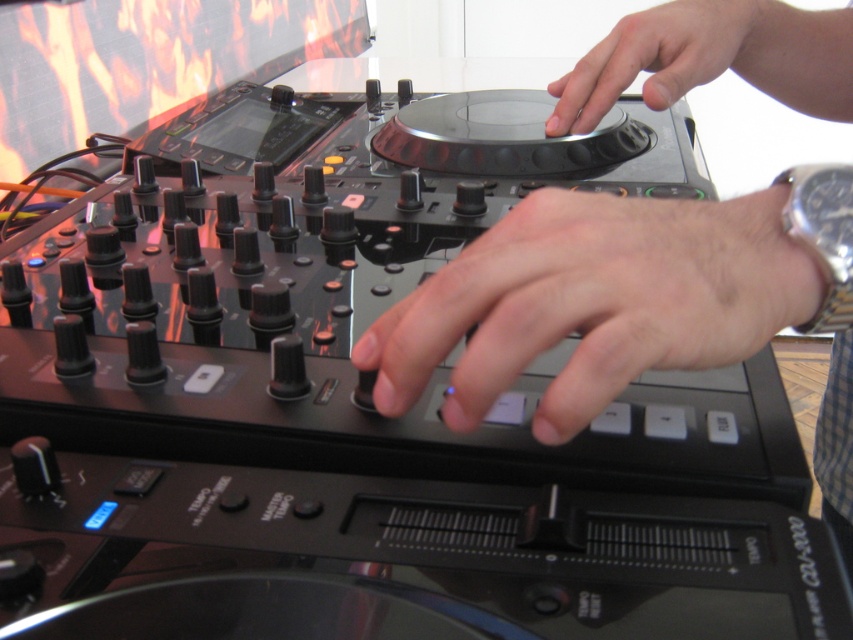
Question: Considering the relative positions of metallic silver turntable at center and matte black turntable at center in the image provided, where is metallic silver turntable at center located with respect to matte black turntable at center?

Choices:
 (A) below
 (B) above

Answer: (A)

Question: Estimate the real-world distances between objects in this image. Which object is closer to the smooth skin hand at center?

Choices:
 (A) metallic silver turntable at center
 (B) silver metallic watch at upper right
 (C) matte black turntable at center

Answer: (B)

Question: Is metallic silver turntable at center positioned in front of smooth skin hand at center?

Choices:
 (A) yes
 (B) no

Answer: (B)

Question: Among these objects, which one is nearest to the camera?

Choices:
 (A) metallic silver turntable at center
 (B) silver metallic watch at upper right
 (C) smooth skin hand at center
 (D) matte black turntable at center

Answer: (C)

Question: Which of the following is the closest to the observer?

Choices:
 (A) (618, 355)
 (B) (838, 268)

Answer: (A)

Question: Can you confirm if matte black turntable at center is bigger than silver metallic watch at upper right?

Choices:
 (A) no
 (B) yes

Answer: (B)